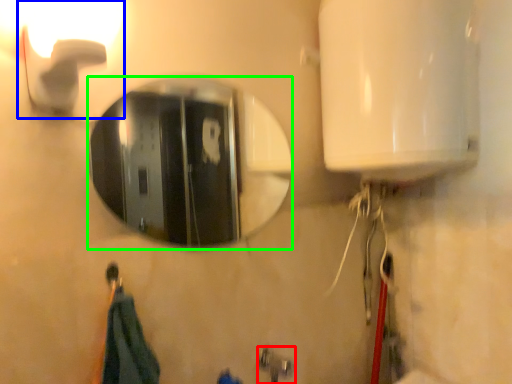
Question: Estimate the real-world distances between objects in this image. Which object is farther from plumbing fixture (highlighted by a red box), light fixture (highlighted by a blue box) or mirror (highlighted by a green box)?

Choices:
 (A) light fixture
 (B) mirror

Answer: (B)